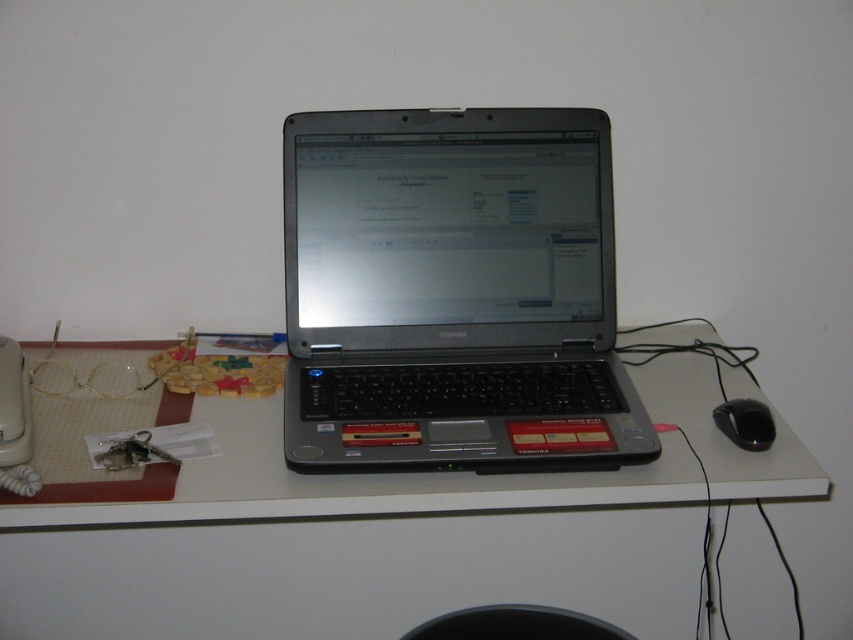
You need to place both the satin silver laptop at center and the black plastic mouse at lower right into a box that can only fit items up to the size of the laptop. Which item will definitely fit inside the box?

The black plastic mouse at lower right will definitely fit inside the box since it is smaller than the satin silver laptop at center, which is the maximum size the box can accommodate.